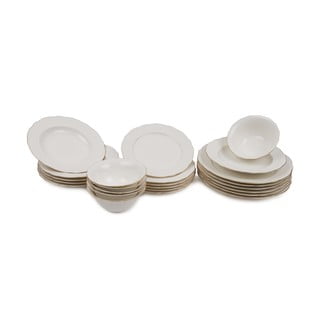
You are a GUI agent. You are given a task and a screenshot of the screen. Output one action in this format:
    pyautogui.click(x=<x>, y=<y>)
    Task: Click on the dishes in fourth stack from the left
    The height and width of the screenshot is (320, 320).
    Given the screenshot: What is the action you would take?
    pyautogui.click(x=253, y=149), pyautogui.click(x=263, y=164), pyautogui.click(x=273, y=177), pyautogui.click(x=270, y=185), pyautogui.click(x=266, y=188), pyautogui.click(x=263, y=193), pyautogui.click(x=260, y=195), pyautogui.click(x=268, y=198)